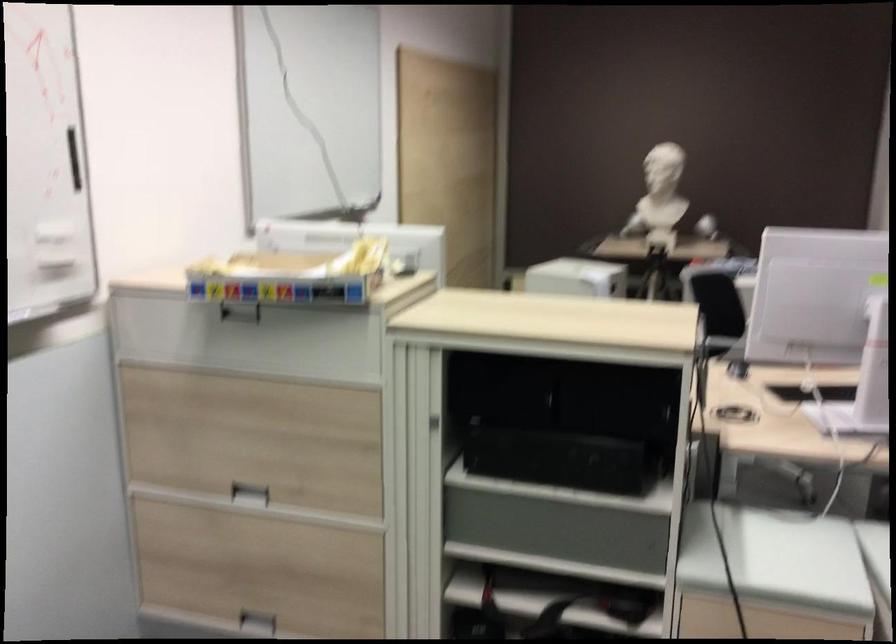
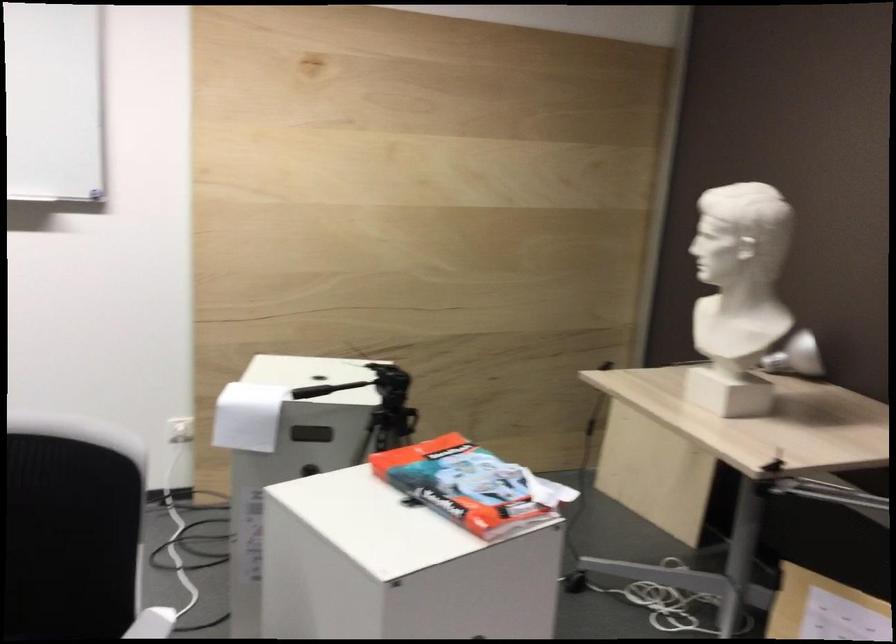
Find the pixel in the second image that matches pixel 599 270 in the first image.

(247, 415)